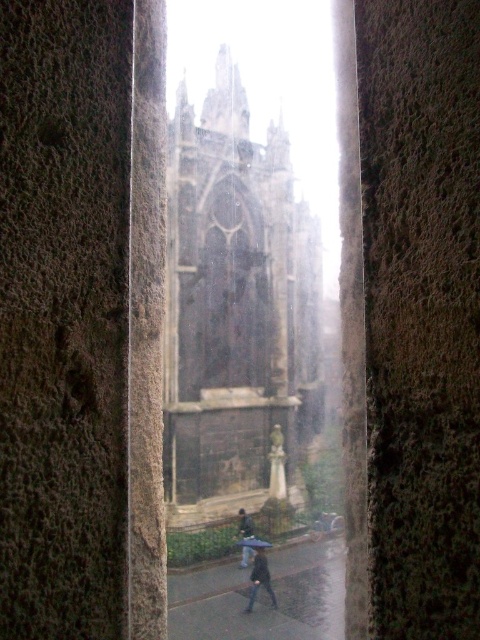
Question: From the image, what is the correct spatial relationship of dark gray fabric coat at center in relation to transparent plastic umbrella at center?

Choices:
 (A) left
 (B) right

Answer: (B)

Question: From the image, what is the correct spatial relationship of dark stone church at center in relation to transparent plastic umbrella at center?

Choices:
 (A) left
 (B) right

Answer: (B)

Question: From the image, what is the correct spatial relationship of dark gray asphalt at center in relation to dark gray fabric coat at center?

Choices:
 (A) below
 (B) above

Answer: (B)

Question: Which point is farther to the camera?

Choices:
 (A) (218, 570)
 (B) (240, 508)
 (C) (289, 474)
 (D) (269, 576)

Answer: (C)

Question: Which of the following is the closest to the observer?

Choices:
 (A) (264, 545)
 (B) (276, 604)
 (C) (195, 625)
 (D) (183, 310)

Answer: (C)

Question: Considering the real-world distances, which object is farthest from the transparent plastic umbrella at center?

Choices:
 (A) dark gray asphalt at center
 (B) dark gray fabric coat at center

Answer: (A)